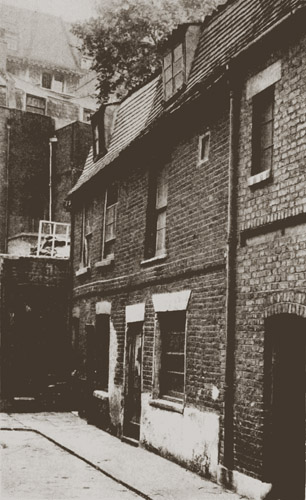
Locate an element on the screen. bottom floor windowsill is located at coordinates (95, 397), (168, 402).